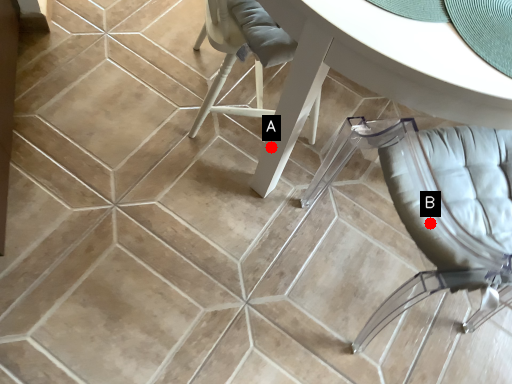
Question: Two points are circled on the image, labeled by A and B beside each circle. Among these points, which one is farthest from the camera?

Choices:
 (A) A is further
 (B) B is further

Answer: (A)